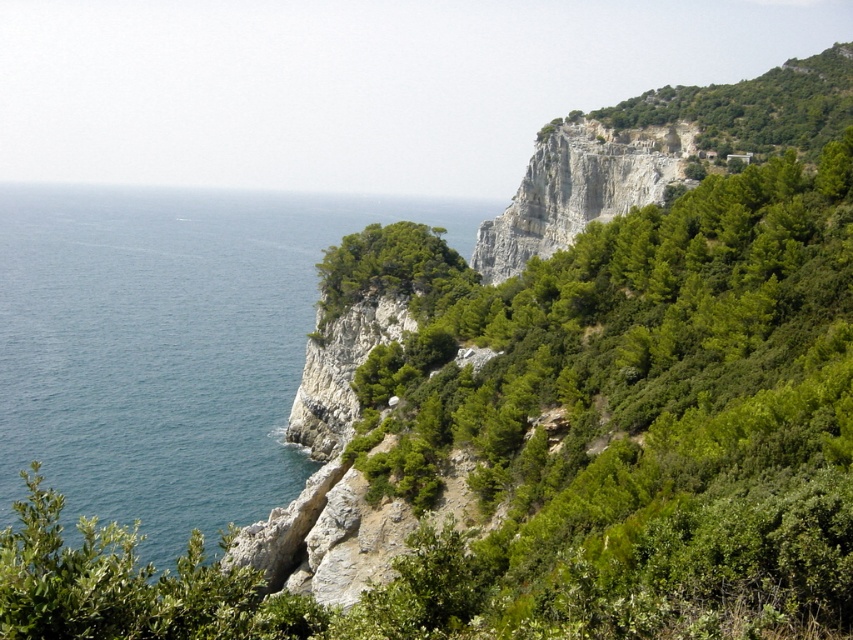
Find the location of a particular element. This screenshot has height=640, width=853. green leafy shrub at upper right is located at coordinates (637, 426).

Is green leafy shrub at upper right positioned at the back of blue water at left?

No, it is in front of blue water at left.

Is point (843, 157) farther from viewer compared to point (236, 301)?

No, it is not.

Where is `green leafy shrub at upper right`? green leafy shrub at upper right is located at coordinates (637, 426).